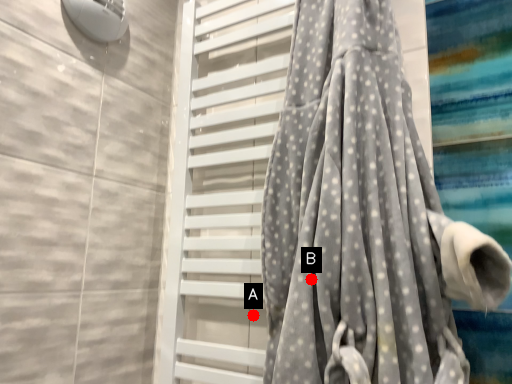
Question: Two points are circled on the image, labeled by A and B beside each circle. Which point is further to the camera?

Choices:
 (A) A is further
 (B) B is further

Answer: (A)